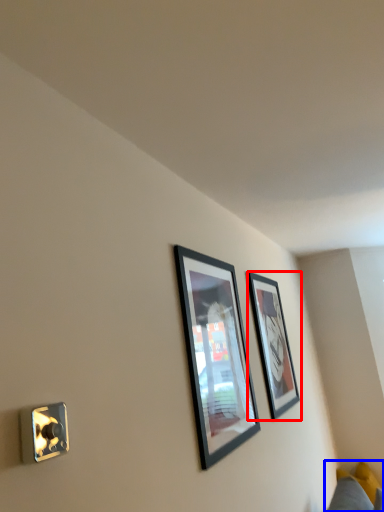
Question: Which object appears closest to the camera in this image, picture frame (highlighted by a red box) or couch (highlighted by a blue box)?

Choices:
 (A) picture frame
 (B) couch

Answer: (A)